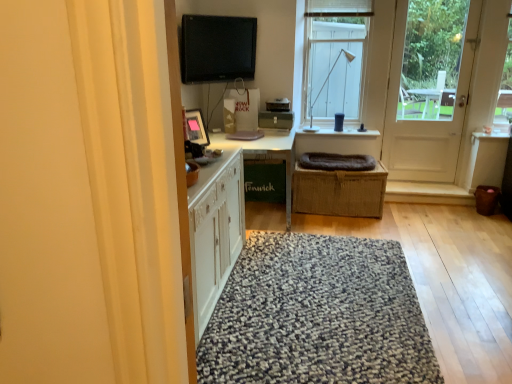
Question: Is black glossy computer monitor at upper center far from white wooden door at right?

Choices:
 (A) no
 (B) yes

Answer: (B)

Question: Considering the relative positions of black glossy computer monitor at upper center and white wooden door at right in the image provided, is black glossy computer monitor at upper center to the left of white wooden door at right from the viewer's perspective?

Choices:
 (A) no
 (B) yes

Answer: (B)

Question: Is black glossy computer monitor at upper center with white wooden door at right?

Choices:
 (A) no
 (B) yes

Answer: (A)

Question: Is black glossy computer monitor at upper center to the right of white wooden door at right from the viewer's perspective?

Choices:
 (A) no
 (B) yes

Answer: (A)

Question: Is the depth of black glossy computer monitor at upper center less than that of white wooden door at right?

Choices:
 (A) no
 (B) yes

Answer: (B)

Question: In the image, is white wooden door at right on the left side or the right side of black glossy computer monitor at upper center?

Choices:
 (A) right
 (B) left

Answer: (A)

Question: From the image's perspective, is white wooden door at right above or below black glossy computer monitor at upper center?

Choices:
 (A) below
 (B) above

Answer: (A)

Question: Considering the positions of white wooden door at right and black glossy computer monitor at upper center in the image, is white wooden door at right wider or thinner than black glossy computer monitor at upper center?

Choices:
 (A) wide
 (B) thin

Answer: (A)

Question: Is white wooden door at right spatially inside black glossy computer monitor at upper center, or outside of it?

Choices:
 (A) inside
 (B) outside

Answer: (B)

Question: Does point (336, 59) appear closer or farther from the camera than point (389, 102)?

Choices:
 (A) closer
 (B) farther

Answer: (B)

Question: From the image's perspective, relative to white wooden door at right, is matte black lamp at upper center above or below?

Choices:
 (A) below
 (B) above

Answer: (B)

Question: Is matte black lamp at upper center situated inside white wooden door at right or outside?

Choices:
 (A) outside
 (B) inside

Answer: (A)

Question: Considering their positions, is matte black lamp at upper center located in front of or behind white wooden door at right?

Choices:
 (A) behind
 (B) front

Answer: (A)

Question: Would you say white glass window at upper center is to the left or to the right of textured gray rug at center in the picture?

Choices:
 (A) right
 (B) left

Answer: (A)

Question: From a real-world perspective, is white glass window at upper center above or below textured gray rug at center?

Choices:
 (A) above
 (B) below

Answer: (A)